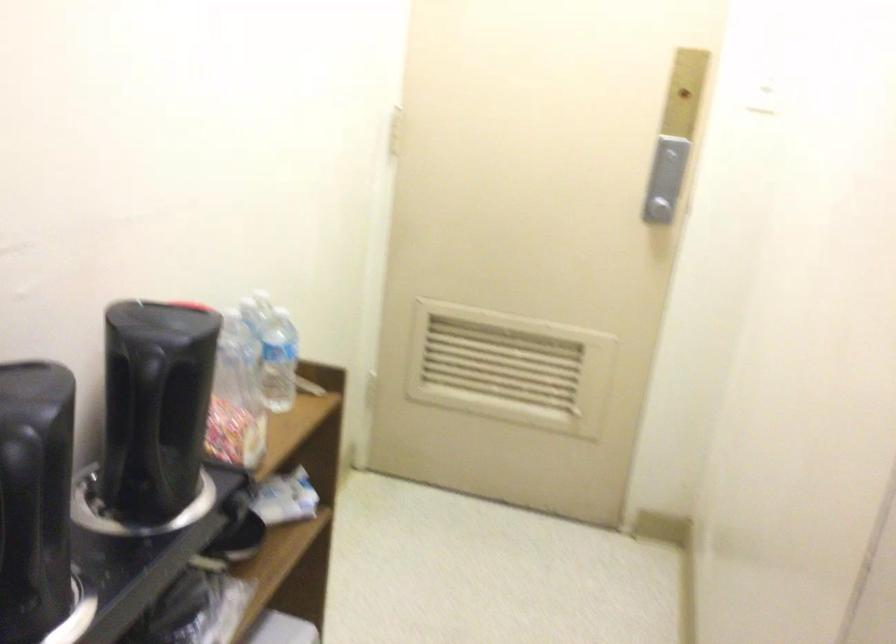
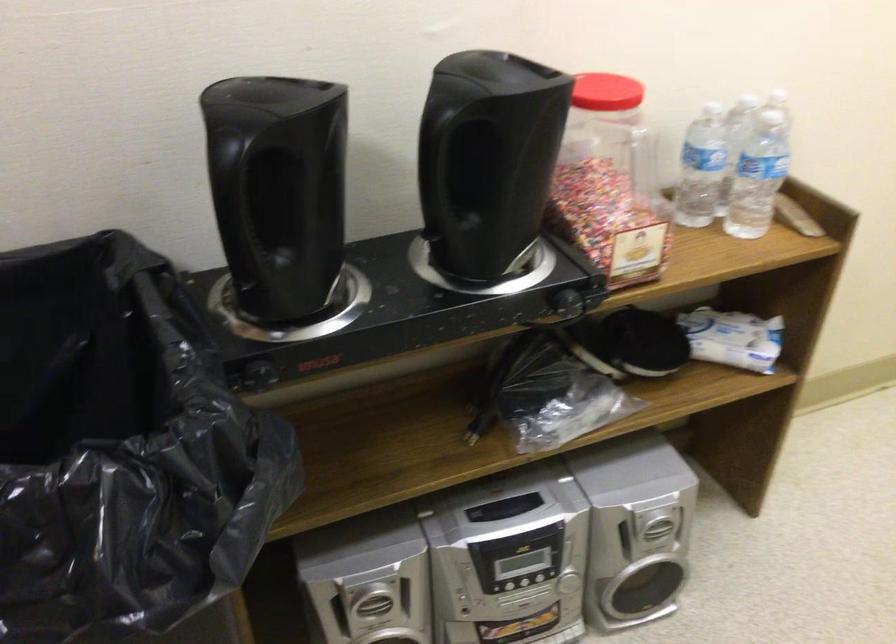
Find the pixel in the second image that matches point (287, 365) in the first image.

(757, 176)